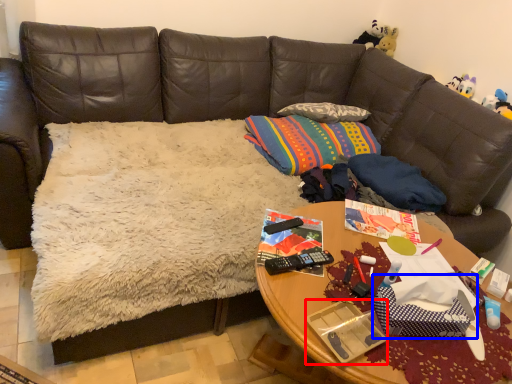
Question: Among these objects, which one is nearest to the camera, package (highlighted by a red box) or gift bag (highlighted by a blue box)?

Choices:
 (A) package
 (B) gift bag

Answer: (A)